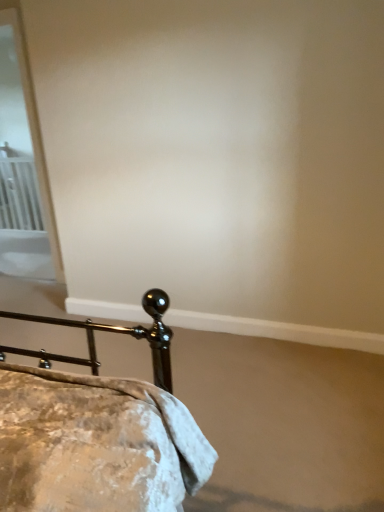
Question: Considering the relative sizes of white metal radiator at left and white glossy screen door at upper left in the image provided, is white metal radiator at left thinner than white glossy screen door at upper left?

Choices:
 (A) yes
 (B) no

Answer: (A)

Question: From the image's perspective, is white metal radiator at left above white glossy screen door at upper left?

Choices:
 (A) no
 (B) yes

Answer: (A)

Question: Is white metal radiator at left not near white glossy screen door at upper left?

Choices:
 (A) no
 (B) yes

Answer: (B)

Question: From a real-world perspective, is white metal radiator at left under white glossy screen door at upper left?

Choices:
 (A) yes
 (B) no

Answer: (A)

Question: Considering the relative positions of white metal radiator at left and white glossy screen door at upper left in the image provided, is white metal radiator at left to the right of white glossy screen door at upper left from the viewer's perspective?

Choices:
 (A) no
 (B) yes

Answer: (A)

Question: Is metallic gold bed at lower left inside or outside of white metal radiator at left?

Choices:
 (A) outside
 (B) inside

Answer: (A)

Question: Is point (21, 371) closer or farther from the camera than point (8, 224)?

Choices:
 (A) closer
 (B) farther

Answer: (A)

Question: In terms of size, does metallic gold bed at lower left appear bigger or smaller than white metal radiator at left?

Choices:
 (A) small
 (B) big

Answer: (B)

Question: Is metallic gold bed at lower left to the left or to the right of white metal radiator at left in the image?

Choices:
 (A) right
 (B) left

Answer: (A)

Question: From the image's perspective, is white metal radiator at left located above or below metallic gold bed at lower left?

Choices:
 (A) below
 (B) above

Answer: (B)

Question: In terms of size, does white metal radiator at left appear bigger or smaller than metallic gold bed at lower left?

Choices:
 (A) small
 (B) big

Answer: (A)

Question: From their relative heights in the image, would you say white metal radiator at left is taller or shorter than metallic gold bed at lower left?

Choices:
 (A) short
 (B) tall

Answer: (B)

Question: Would you say white metal radiator at left is inside or outside metallic gold bed at lower left?

Choices:
 (A) inside
 (B) outside

Answer: (B)

Question: Which is correct: white glossy screen door at upper left is inside white metal radiator at left, or outside of it?

Choices:
 (A) inside
 (B) outside

Answer: (B)

Question: Considering the relative positions of white glossy screen door at upper left and white metal radiator at left in the image provided, is white glossy screen door at upper left to the left or to the right of white metal radiator at left?

Choices:
 (A) right
 (B) left

Answer: (A)